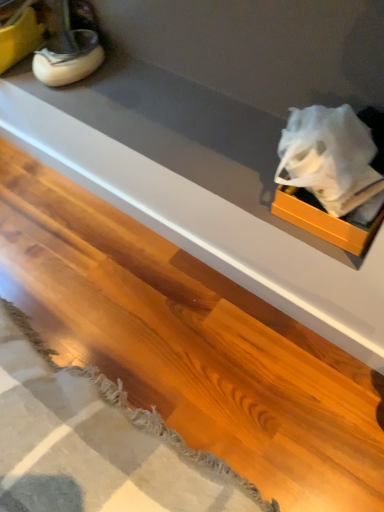
Question: Would you say orange matte box at upper right is part of matte white counter at upper right's contents?

Choices:
 (A) no
 (B) yes

Answer: (A)

Question: Is matte white counter at upper right positioned far away from orange matte box at upper right?

Choices:
 (A) no
 (B) yes

Answer: (A)

Question: Is matte white counter at upper right thinner than orange matte box at upper right?

Choices:
 (A) no
 (B) yes

Answer: (B)

Question: Is matte white counter at upper right not inside orange matte box at upper right?

Choices:
 (A) no
 (B) yes

Answer: (B)

Question: Is matte white counter at upper right positioned with its back to orange matte box at upper right?

Choices:
 (A) yes
 (B) no

Answer: (B)

Question: Considering the positions of point (365, 245) and point (64, 33), is point (365, 245) closer or farther from the camera than point (64, 33)?

Choices:
 (A) farther
 (B) closer

Answer: (B)

Question: From the image's perspective, is orange matte box at upper right positioned above or below white rubber shoe at upper left?

Choices:
 (A) below
 (B) above

Answer: (A)

Question: Relative to white rubber shoe at upper left, is orange matte box at upper right in front or behind?

Choices:
 (A) behind
 (B) front

Answer: (B)

Question: Is orange matte box at upper right taller or shorter than white rubber shoe at upper left?

Choices:
 (A) tall
 (B) short

Answer: (B)

Question: From a real-world perspective, is orange matte box at upper right above or below matte white counter at upper right?

Choices:
 (A) below
 (B) above

Answer: (B)

Question: Considering the positions of orange matte box at upper right and matte white counter at upper right in the image, is orange matte box at upper right taller or shorter than matte white counter at upper right?

Choices:
 (A) tall
 (B) short

Answer: (B)

Question: Would you say orange matte box at upper right is inside or outside matte white counter at upper right?

Choices:
 (A) inside
 (B) outside

Answer: (B)

Question: Would you say orange matte box at upper right is to the left or to the right of matte white counter at upper right in the picture?

Choices:
 (A) right
 (B) left

Answer: (A)

Question: Relative to matte white counter at upper right, is white rubber shoe at upper left in front or behind?

Choices:
 (A) behind
 (B) front

Answer: (A)

Question: Do you think white rubber shoe at upper left is within matte white counter at upper right, or outside of it?

Choices:
 (A) inside
 (B) outside

Answer: (B)